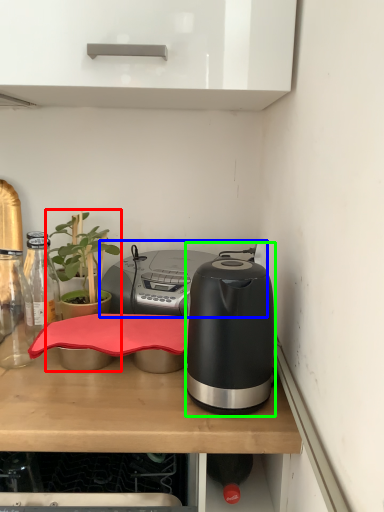
Question: Considering the real-world distances, which object is farthest from houseplant (highlighted by a red box)? appliance (highlighted by a blue box) or kitchen appliance (highlighted by a green box)?

Choices:
 (A) appliance
 (B) kitchen appliance

Answer: (B)